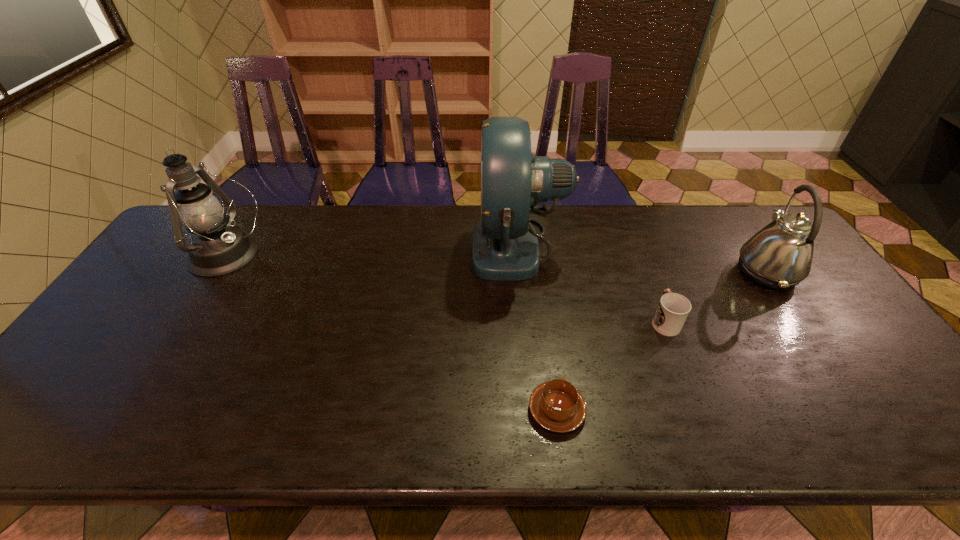
The height and width of the screenshot is (540, 960). What are the coordinates of `the tallest object` in the screenshot? It's located at (505, 247).

Find the location of a particular element. The height and width of the screenshot is (540, 960). oil lamp is located at coordinates (217, 248).

Where is `the leftmost object`? the leftmost object is located at coordinates (217, 248).

Where is `the rightmost object`? This screenshot has height=540, width=960. the rightmost object is located at coordinates (779, 256).

This screenshot has width=960, height=540. In order to click on the third shortest object in this screenshot , I will do `click(779, 256)`.

You are a GUI agent. You are given a task and a screenshot of the screen. Output one action in this format:
    pyautogui.click(x=<x>, y=<y>)
    Task: Click on the second shortest object
    The height and width of the screenshot is (540, 960).
    Given the screenshot: What is the action you would take?
    pyautogui.click(x=673, y=309)

This screenshot has height=540, width=960. I want to click on the second object from right to left, so click(x=673, y=309).

Locate an element on the screen. the nearest object is located at coordinates (556, 405).

Where is `the shortest object`? The image size is (960, 540). the shortest object is located at coordinates (556, 405).

You are a GUI agent. You are given a task and a screenshot of the screen. Output one action in this format:
    pyautogui.click(x=<x>, y=<y>)
    Task: Click on the vacant space located 0.220m in front of the tallest object to blow air
    The height and width of the screenshot is (540, 960).
    Given the screenshot: What is the action you would take?
    pyautogui.click(x=402, y=247)